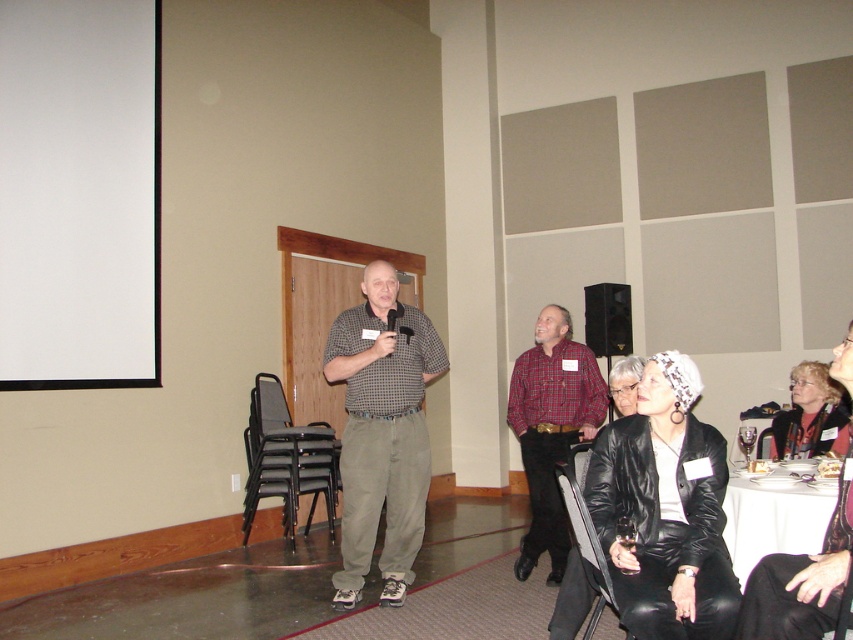
Based on the photo, is checkered fabric shirt at center to the right of plaid shirt at center from the viewer's perspective?

In fact, checkered fabric shirt at center is to the left of plaid shirt at center.

Find the location of a particular element. checkered fabric shirt at center is located at coordinates (381, 433).

Does plaid shirt at center have a larger size compared to white cloth-covered table at lower right?

Indeed, plaid shirt at center has a larger size compared to white cloth-covered table at lower right.

The width and height of the screenshot is (853, 640). What do you see at coordinates (550, 429) in the screenshot?
I see `plaid shirt at center` at bounding box center [550, 429].

The image size is (853, 640). I want to click on plaid shirt at center, so click(550, 429).

Does white matte projection screen at upper left appear over plaid shirt at center?

Yes, white matte projection screen at upper left is above plaid shirt at center.

I want to click on white matte projection screen at upper left, so click(79, 193).